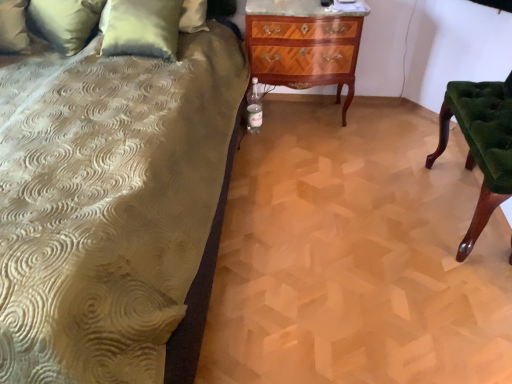
Find the location of `vacant space in front of mahogany wood chest of drawers at center`. vacant space in front of mahogany wood chest of drawers at center is located at coordinates (300, 156).